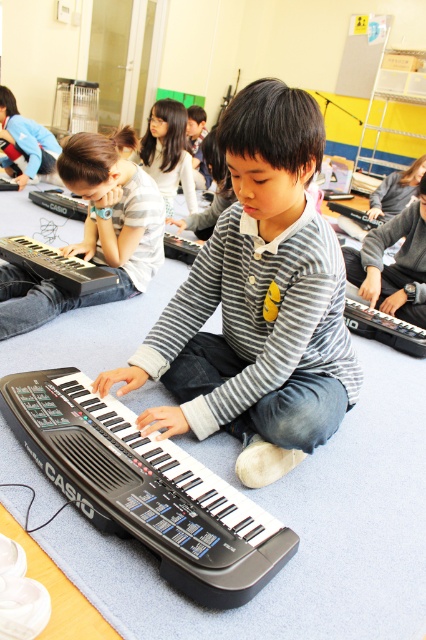
Who is lower down, gray striped shirt at center or black plastic keyboard at lower left?

gray striped shirt at center is below.

Is gray striped shirt at center above black plastic keyboard at lower left?

Actually, gray striped shirt at center is below black plastic keyboard at lower left.

Find the location of `gray striped shirt at center`. gray striped shirt at center is located at coordinates (258, 301).

Is point (170, 177) positioned behind point (37, 266)?

Yes.

Can you confirm if light brown hair at upper center is wider than black plastic keyboard at lower left?

Incorrect, light brown hair at upper center's width does not surpass black plastic keyboard at lower left's.

Does point (152, 109) lie behind point (23, 246)?

Yes.

Identify the location of light brown hair at upper center. (167, 152).

This screenshot has height=640, width=426. I want to click on black plastic keyboard at center, so click(146, 488).

Does point (92, 483) come behind point (169, 99)?

That is False.

I want to click on black plastic keyboard at center, so click(146, 488).